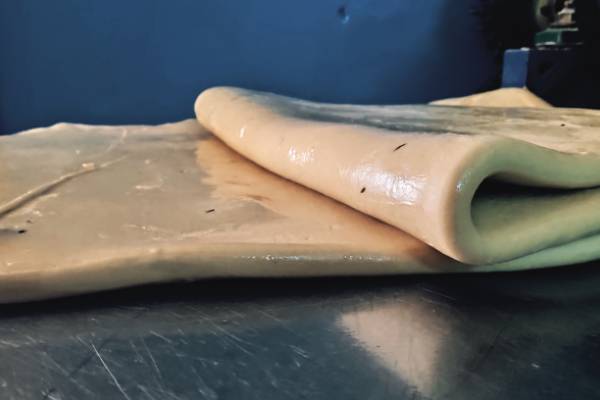
Image resolution: width=600 pixels, height=400 pixels. I want to click on dent in metal backsplash, so click(343, 17).